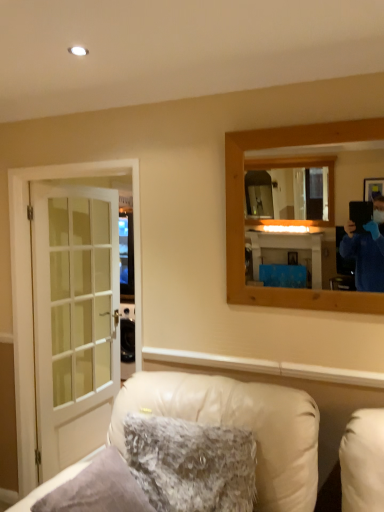
In the scene shown: In order to face fuzzy fabric pillow at lower center, should I rotate leftwards or rightwards?

Rotate your view left by about 1.550°.

Measure the distance between white glass door at left and camera.

They are 2.41 meters apart.

This screenshot has width=384, height=512. Identify the location of fuzzy fabric pillow at lower center. (191, 464).

Could you tell me if white leather chair at lower center is turned towards wooden mirror at upper right?

No.

Where is `furniture below the wooden mirror at upper right (from a real-world perspective)`? furniture below the wooden mirror at upper right (from a real-world perspective) is located at coordinates (239, 426).

In terms of size, does white leather chair at lower center appear bigger or smaller than wooden mirror at upper right?

Considering their sizes, white leather chair at lower center takes up more space than wooden mirror at upper right.

Is wooden mirror at upper right at the back of white glass door at left?

white glass door at left is not turned away from wooden mirror at upper right.

From a real-world perspective, which is physically above, white glass door at left or wooden mirror at upper right?

In real-world perspective, wooden mirror at upper right is above.

Is wooden mirror at upper right located within white glass door at left?

No, wooden mirror at upper right is not inside white glass door at left.

Consider the image. Is white leather chair at lower center far from white glass door at left?

Yes, white leather chair at lower center and white glass door at left are quite far apart.

Is point (278, 431) closer to viewer compared to point (55, 211)?

Yes, it is.

Based on the photo, considering the sizes of objects white leather chair at lower center and white glass door at left in the image provided, who is wider, white leather chair at lower center or white glass door at left?

Wider between the two is white leather chair at lower center.

From the image's perspective, is white leather chair at lower center over white glass door at left?

Actually, white leather chair at lower center appears below white glass door at left in the image.

Which is behind, point (53, 259) or point (236, 495)?

The point (53, 259) is more distant.

Considering the sizes of objects white glass door at left and fuzzy fabric pillow at lower center in the image provided, who is shorter, white glass door at left or fuzzy fabric pillow at lower center?

fuzzy fabric pillow at lower center is shorter.

Is white glass door at left positioned beyond the bounds of fuzzy fabric pillow at lower center?

Yes, white glass door at left is not within fuzzy fabric pillow at lower center.

Are white glass door at left and fuzzy fabric pillow at lower center located far from each other?

white glass door at left is positioned a significant distance from fuzzy fabric pillow at lower center.

Can you confirm if white leather chair at lower center is taller than fuzzy fabric pillow at lower center?

Indeed, white leather chair at lower center has a greater height compared to fuzzy fabric pillow at lower center.

Based on the photo, does white leather chair at lower center turn towards fuzzy fabric pillow at lower center?

Yes, white leather chair at lower center faces towards fuzzy fabric pillow at lower center.

Considering the relative positions of white leather chair at lower center and fuzzy fabric pillow at lower center in the image provided, is white leather chair at lower center to the left or to the right of fuzzy fabric pillow at lower center?

white leather chair at lower center is positioned on fuzzy fabric pillow at lower center's left side.

How much distance is there between fuzzy fabric pillow at lower center and wooden mirror at upper right?

The distance of fuzzy fabric pillow at lower center from wooden mirror at upper right is 6.13 feet.

Does fuzzy fabric pillow at lower center lie in front of wooden mirror at upper right?

Yes, the depth of fuzzy fabric pillow at lower center is less than that of wooden mirror at upper right.

How different are the orientations of fuzzy fabric pillow at lower center and wooden mirror at upper right in degrees?

2.78 degrees separate the facing orientations of fuzzy fabric pillow at lower center and wooden mirror at upper right.

Is fuzzy fabric pillow at lower center beside wooden mirror at upper right?

No, fuzzy fabric pillow at lower center is not touching wooden mirror at upper right.

Considering the sizes of objects fuzzy fabric pillow at lower center and white glass door at left in the image provided, who is taller, fuzzy fabric pillow at lower center or white glass door at left?

white glass door at left.

From a real-world perspective, which is physically below, fuzzy fabric pillow at lower center or white glass door at left?

fuzzy fabric pillow at lower center, from a real-world perspective.

In the image, is fuzzy fabric pillow at lower center positioned in front of or behind white glass door at left?

fuzzy fabric pillow at lower center is in front of white glass door at left.

Locate an element on the screen. Image resolution: width=384 pixels, height=512 pixels. door to the left of fuzzy fabric pillow at lower center is located at coordinates (74, 319).

Where is `mirror above the white leather chair at lower center (from the image's perspective)`? mirror above the white leather chair at lower center (from the image's perspective) is located at coordinates (289, 214).

Find the location of a particular element. The height and width of the screenshot is (512, 384). door below the wooden mirror at upper right (from the image's perspective) is located at coordinates (74, 319).

Considering their positions, is fuzzy fabric pillow at lower center positioned further to wooden mirror at upper right than white leather chair at lower center?

Based on the image, fuzzy fabric pillow at lower center appears to be further to wooden mirror at upper right.

Looking at the image, which one is located closer to white leather chair at lower center, white glass door at left or fuzzy fabric pillow at lower center?

fuzzy fabric pillow at lower center.

Looking at the image, which one is located closer to white glass door at left, fuzzy fabric pillow at lower center or white leather chair at lower center?

white leather chair at lower center is positioned closer to the anchor white glass door at left.

From the image, which object appears to be farther from fuzzy fabric pillow at lower center, white glass door at left or white leather chair at lower center?

Among the two, white glass door at left is located further to fuzzy fabric pillow at lower center.

When comparing their distances from wooden mirror at upper right, does fuzzy fabric pillow at lower center or white glass door at left seem closer?

white glass door at left is positioned closer to the anchor wooden mirror at upper right.

Considering their positions, is fuzzy fabric pillow at lower center positioned further to white leather chair at lower center than white glass door at left?

white glass door at left is further to white leather chair at lower center.

Estimate the real-world distances between objects in this image. Which object is further from fuzzy fabric pillow at lower center, white glass door at left or wooden mirror at upper right?

wooden mirror at upper right is positioned further to the anchor fuzzy fabric pillow at lower center.

In the scene shown: Based on their spatial positions, is white glass door at left or wooden mirror at upper right closer to white leather chair at lower center?

white glass door at left is positioned closer to the anchor white leather chair at lower center.

Where is `pillow positioned between white leather chair at lower center and white glass door at left from near to far`? The width and height of the screenshot is (384, 512). pillow positioned between white leather chair at lower center and white glass door at left from near to far is located at coordinates (191, 464).

Find the location of `pillow between wooden mirror at upper right and white leather chair at lower center vertically`. pillow between wooden mirror at upper right and white leather chair at lower center vertically is located at coordinates (191, 464).

You are a GUI agent. You are given a task and a screenshot of the screen. Output one action in this format:
    pyautogui.click(x=<x>, y=<y>)
    Task: Click on the pillow situated between white glass door at left and wooden mirror at upper right from left to right
    The height and width of the screenshot is (512, 384).
    Given the screenshot: What is the action you would take?
    pyautogui.click(x=191, y=464)

Image resolution: width=384 pixels, height=512 pixels. Find the location of `mirror positioned between white leather chair at lower center and white glass door at left from near to far`. mirror positioned between white leather chair at lower center and white glass door at left from near to far is located at coordinates (289, 214).